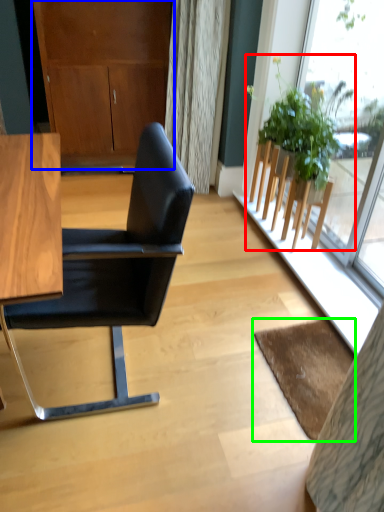
Question: Which object is positioned closest to houseplant (highlighted by a red box)? Select from dresser (highlighted by a blue box) and mat (highlighted by a green box).

Choices:
 (A) dresser
 (B) mat

Answer: (B)